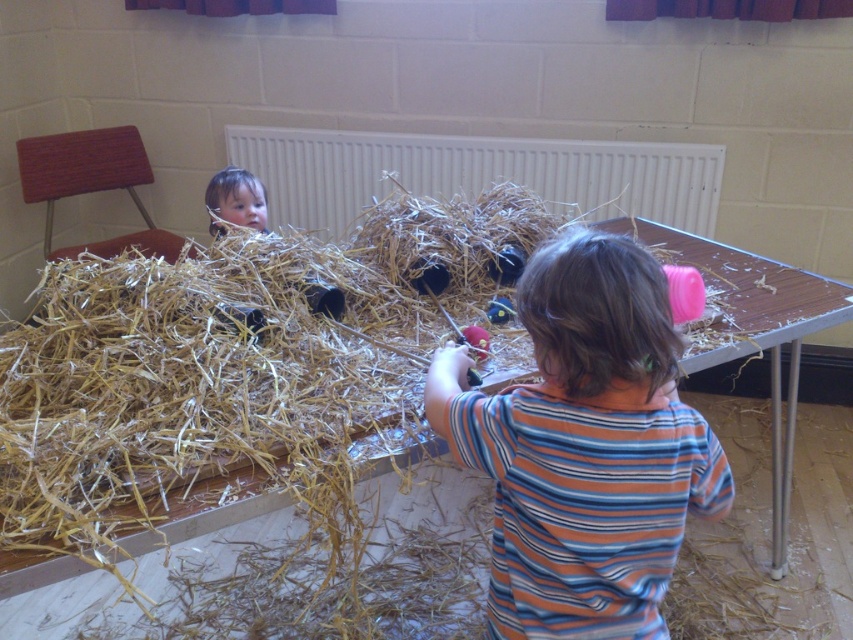
Question: Which point is closer to the camera?

Choices:
 (A) (262, 209)
 (B) (639, 541)
 (C) (451, 186)
 (D) (381, 355)

Answer: (B)

Question: Can you confirm if striped cotton shirt at center is wider than smooth brown hair at upper left?

Choices:
 (A) yes
 (B) no

Answer: (A)

Question: Which object appears closest to the camera in this image?

Choices:
 (A) striped cotton shirt at center
 (B) smooth brown hair at upper left
 (C) white matte radiator at upper center
 (D) natural straw at center

Answer: (A)

Question: Considering the relative positions of natural straw at center and white matte radiator at upper center in the image provided, where is natural straw at center located with respect to white matte radiator at upper center?

Choices:
 (A) above
 (B) below

Answer: (B)

Question: Is natural straw at center below white matte radiator at upper center?

Choices:
 (A) no
 (B) yes

Answer: (B)

Question: Based on their relative distances, which object is nearer to the natural straw at center?

Choices:
 (A) white matte radiator at upper center
 (B) smooth brown hair at upper left

Answer: (B)